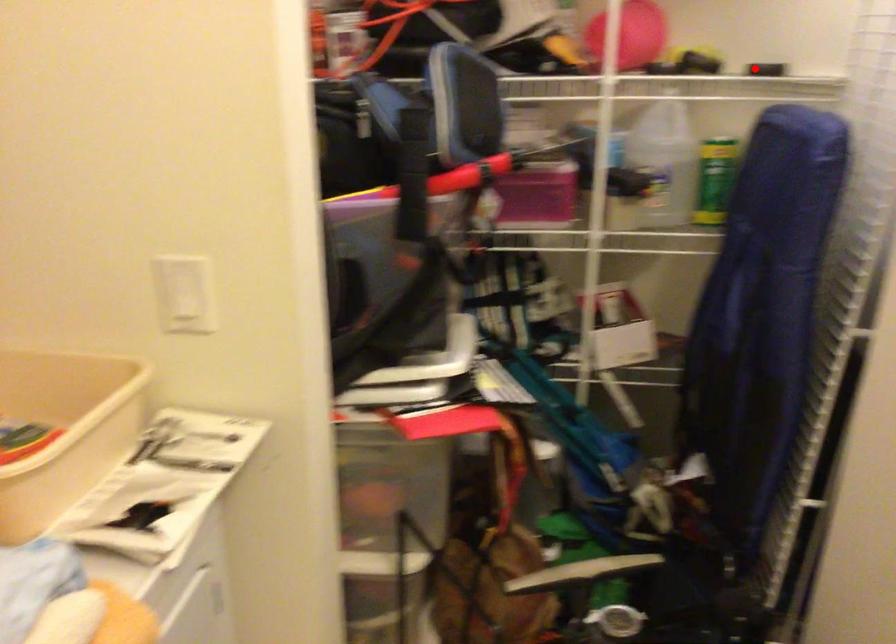
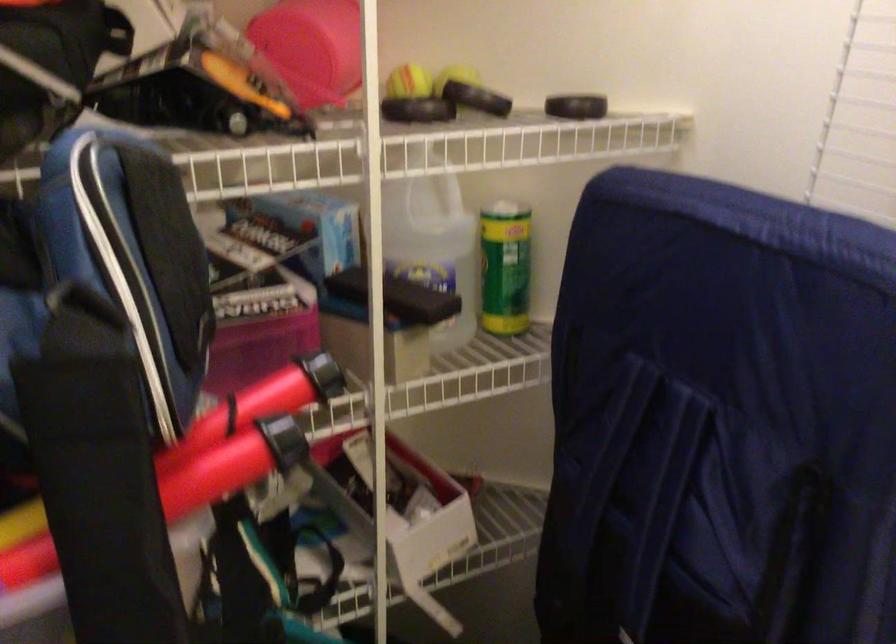
Question: A red point is marked in image1. In image2, is the corresponding 3D point closer to the camera or farther? Reply with the corresponding letter.

Choices:
 (A) The corresponding 3D point is closer.
 (B) The corresponding 3D point is farther.

Answer: (A)